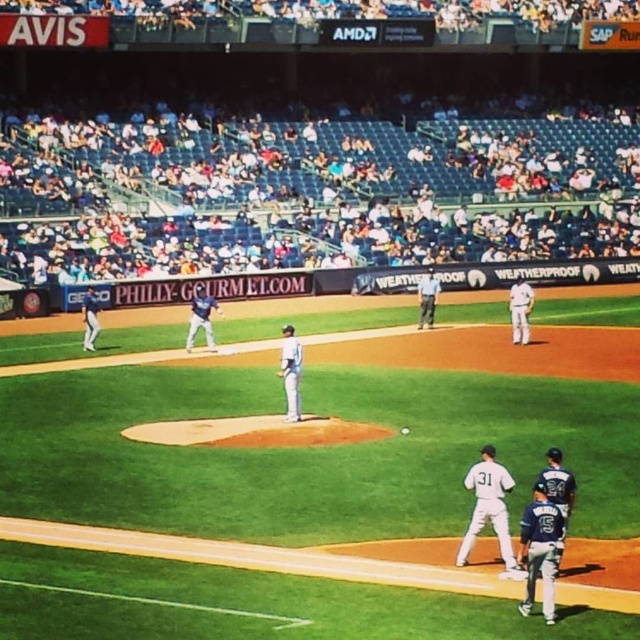
You are a photographer at the baseball game and want to capture a photo of the white matte baseball player at lower right and the white matte uniform at lower right. Based on their positions, which one should you focus on first to ensure they are both in the frame?

You should focus on the white matte baseball player at lower right first because the white matte uniform at lower right is to the right of it, so adjusting the frame to include the player will naturally include the uniform as well.

You are a photographer taking a picture of the baseball game. You need to ensure that both the white matte uniform at lower right and the blue uniform at center are clearly visible in the frame. Based on their heights, which uniform might require you to adjust your camera angle to avoid being blocked by the other?

The white matte uniform at lower right is shorter than the blue uniform at center, so you might need to lower your camera angle to ensure the shorter uniform isn

You are a photographer at the stadium and want to capture a photo where both the white matte uniform at center and the blue uniform at center are clearly visible. Based on their sizes, which uniform might appear smaller in the photo?

The white matte uniform at center is thinner than the blue uniform at center, so it might appear smaller in the photo.